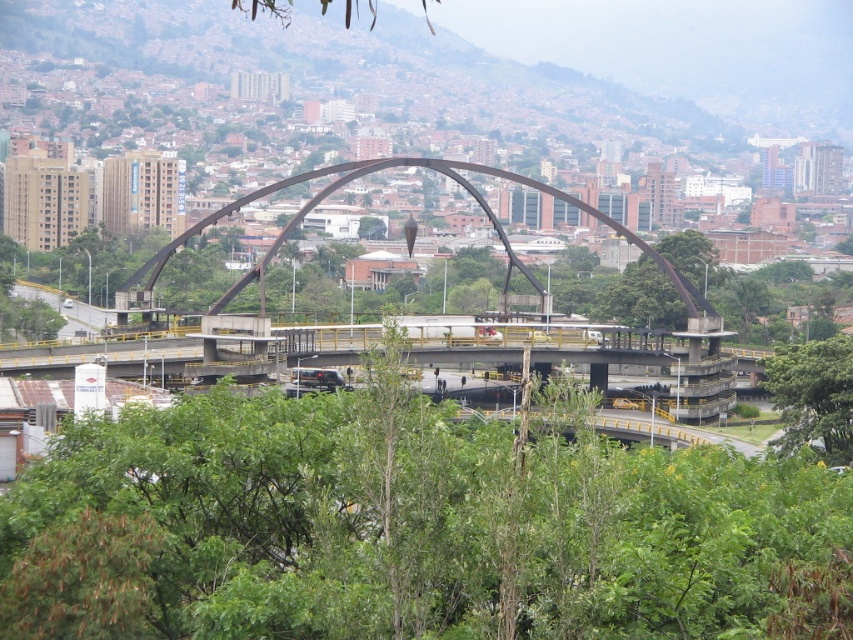
Based on the photo, you are a city planner analyzing the urban layout. You need to determine which object occupies more visual space in the scene. Based on the provided information, which one is larger between the metallic bridge at center and the green leafy tree at lower right?

The metallic bridge at center has a larger size compared to the green leafy tree at lower right, so the metallic bridge at center occupies more visual space in the scene.

You are standing at the base of the large arched structure in the cityscape image. There are two points of interest marked on the scene at coordinates point (422, 442) and point (500, 230). Which point is nearer to your current position?

Point (422, 442) is closer to the camera than point (500, 230), so it is nearer to your current position at the base of the arched structure.